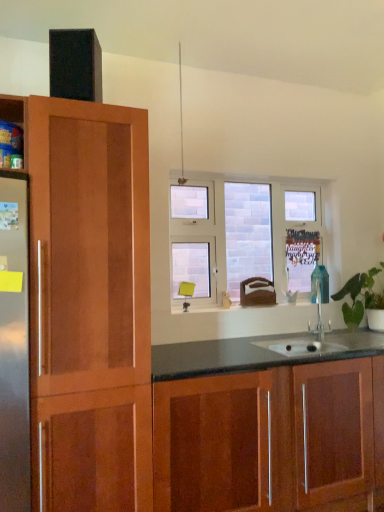
Question: From the image's perspective, is clear glass window at center on top of glossy wood cabinets at lower center?

Choices:
 (A) yes
 (B) no

Answer: (A)

Question: Is glossy wood cabinets at lower center inside clear glass window at center?

Choices:
 (A) no
 (B) yes

Answer: (A)

Question: Is clear glass window at center shorter than glossy wood cabinets at lower center?

Choices:
 (A) yes
 (B) no

Answer: (B)

Question: Considering the relative positions of clear glass window at center and glossy wood cabinets at lower center in the image provided, is clear glass window at center to the right of glossy wood cabinets at lower center from the viewer's perspective?

Choices:
 (A) yes
 (B) no

Answer: (B)

Question: Is the depth of clear glass window at center less than that of glossy wood cabinets at lower center?

Choices:
 (A) no
 (B) yes

Answer: (A)

Question: Is green leafy plant at right wider or thinner than clear glass window at center?

Choices:
 (A) wide
 (B) thin

Answer: (A)

Question: Is point (370, 305) closer or farther from the camera than point (190, 230)?

Choices:
 (A) farther
 (B) closer

Answer: (B)

Question: Is green leafy plant at right inside the boundaries of clear glass window at center, or outside?

Choices:
 (A) outside
 (B) inside

Answer: (A)

Question: Considering the positions of green leafy plant at right and clear glass window at center in the image, is green leafy plant at right bigger or smaller than clear glass window at center?

Choices:
 (A) small
 (B) big

Answer: (B)

Question: Considering the positions of point (362, 294) and point (205, 452), is point (362, 294) closer or farther from the camera than point (205, 452)?

Choices:
 (A) closer
 (B) farther

Answer: (B)

Question: Based on their positions, is green leafy plant at right located to the left or right of glossy wood cabinets at lower center?

Choices:
 (A) left
 (B) right

Answer: (B)

Question: From the image's perspective, relative to glossy wood cabinets at lower center, is green leafy plant at right above or below?

Choices:
 (A) above
 (B) below

Answer: (A)

Question: Considering the positions of green leafy plant at right and glossy wood cabinets at lower center in the image, is green leafy plant at right wider or thinner than glossy wood cabinets at lower center?

Choices:
 (A) thin
 (B) wide

Answer: (A)

Question: Looking at the image, does clear glass window at center seem bigger or smaller compared to green leafy plant at right?

Choices:
 (A) big
 (B) small

Answer: (B)

Question: Does point pyautogui.click(x=309, y=185) appear closer or farther from the camera than point pyautogui.click(x=354, y=317)?

Choices:
 (A) farther
 (B) closer

Answer: (A)